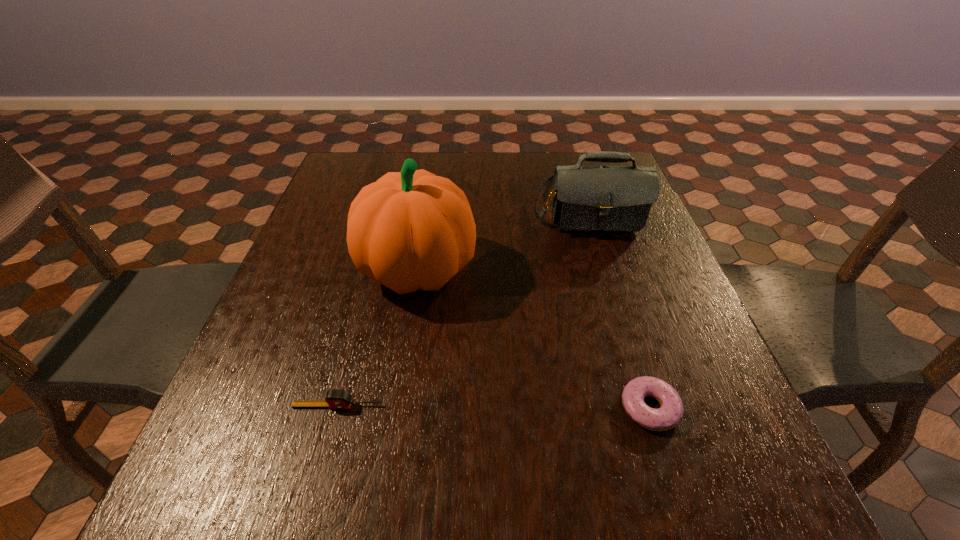
You are a GUI agent. You are given a task and a screenshot of the screen. Output one action in this format:
    pyautogui.click(x=<x>, y=<y>)
    Task: Click on the tallest object
    This screenshot has height=540, width=960.
    Given the screenshot: What is the action you would take?
    pyautogui.click(x=410, y=230)

The width and height of the screenshot is (960, 540). What are the coordinates of `the second tallest object` in the screenshot? It's located at 584,198.

Find the location of a particular element. This screenshot has height=540, width=960. tape measure is located at coordinates click(334, 399).

The width and height of the screenshot is (960, 540). Identify the location of doughnut. (670, 413).

Locate an element on the screen. vacant space situated on the front of the pumpkin is located at coordinates (394, 426).

I want to click on vacant space located on the front of the second tallest object, so click(x=606, y=271).

The height and width of the screenshot is (540, 960). I want to click on free space located 0.120m on the left of the tape measure, so click(x=224, y=406).

Identify the location of free spot located 0.260m on the back of the shortest object. This screenshot has height=540, width=960. (612, 284).

Where is `object positioned at the far edge`? The image size is (960, 540). object positioned at the far edge is located at coordinates (584, 198).

You are a GUI agent. You are given a task and a screenshot of the screen. Output one action in this format:
    pyautogui.click(x=<x>, y=<y>)
    Task: Click on the pumpkin present at the left edge
    
    Given the screenshot: What is the action you would take?
    pyautogui.click(x=410, y=230)